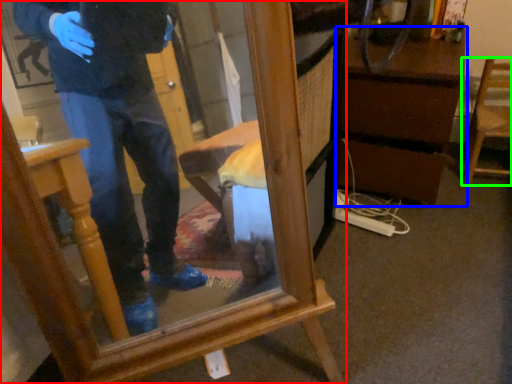
Question: Considering the real-world distances, which object is closest to furniture (highlighted by a red box)? vanity (highlighted by a blue box) or chair (highlighted by a green box).

Choices:
 (A) vanity
 (B) chair

Answer: (A)